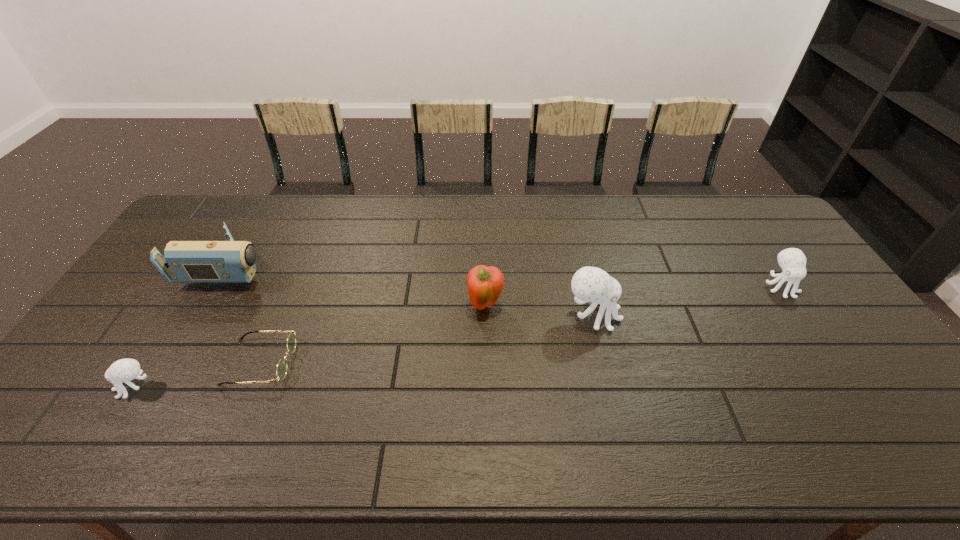
Find the location of a particular element. The width and height of the screenshot is (960, 540). the closest octopus relative to the fifth tallest object is located at coordinates (589, 284).

Image resolution: width=960 pixels, height=540 pixels. What are the coordinates of `free space in the image that satisfies the following two spatial constraints: 1. on the front-facing side of the fourth tallest object; 2. on the lenses of the shortest object` in the screenshot? It's located at (831, 362).